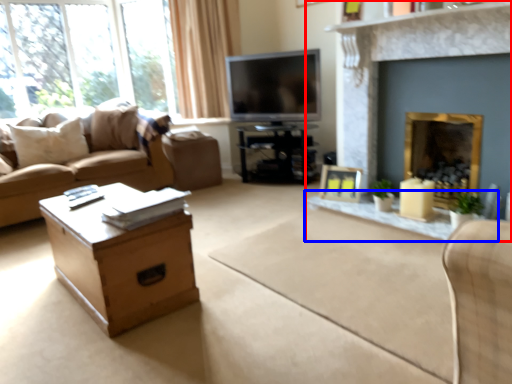
Question: Which object is further to the camera taking this photo, fireplace (highlighted by a red box) or glass table (highlighted by a blue box)?

Choices:
 (A) fireplace
 (B) glass table

Answer: (B)